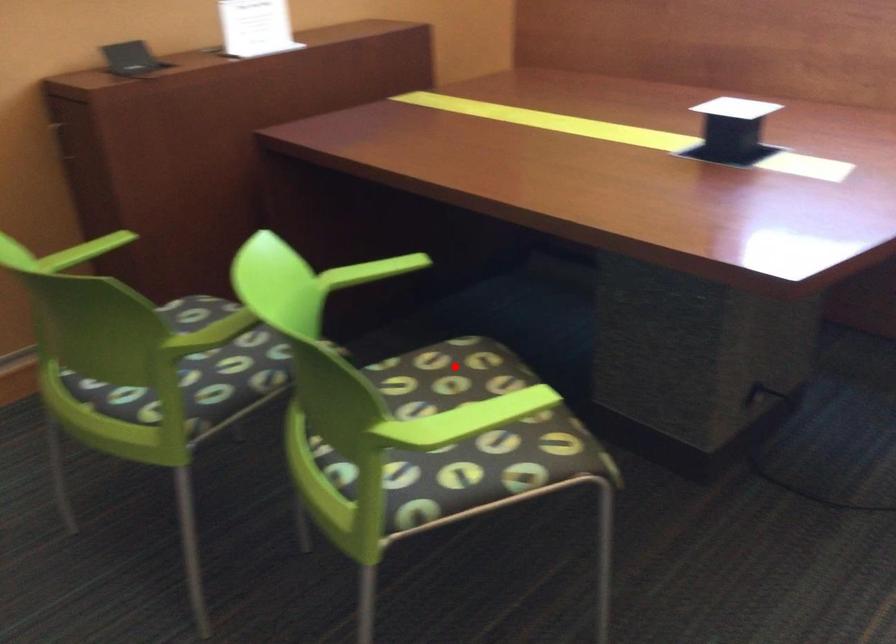
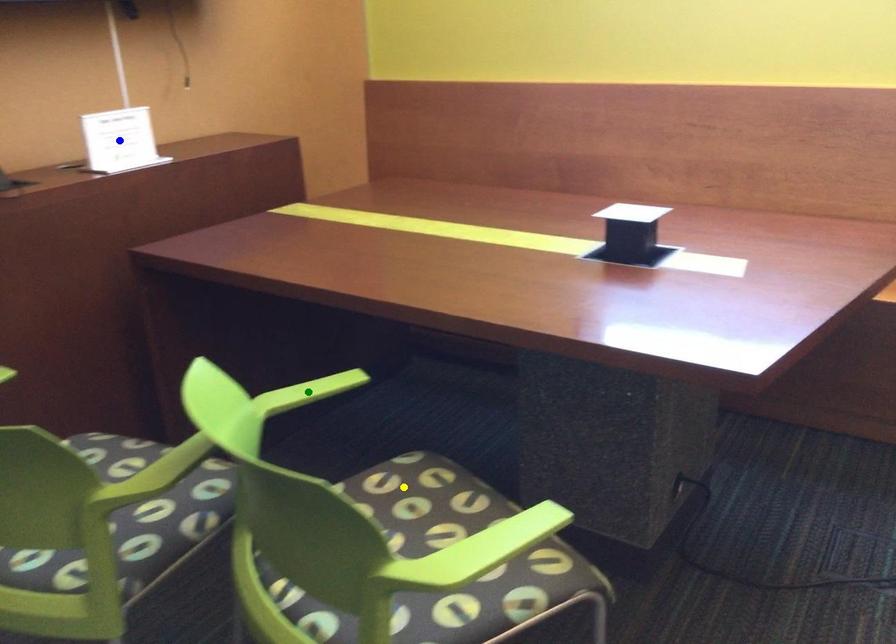
Question: I am providing you with two images of the same scene from different viewpoints. A red point is marked on the first image. You are given multiple points on the second image. Which mark in image 2 goes with the point in image 1?

Choices:
 (A) yellow point
 (B) blue point
 (C) green point

Answer: (A)